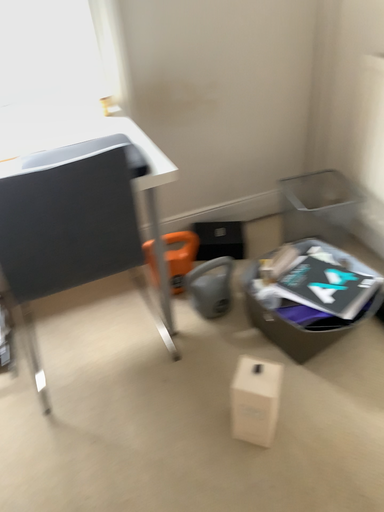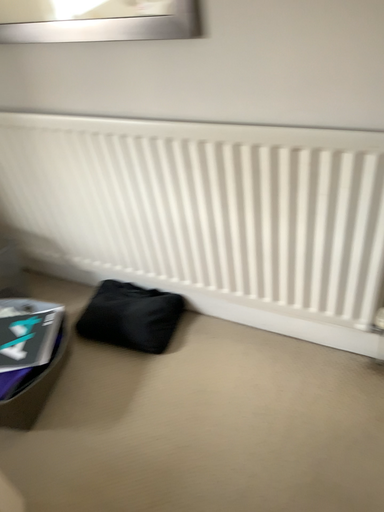
Question: Which way did the camera rotate in the video?

Choices:
 (A) rotated downward
 (B) rotated upward

Answer: (B)